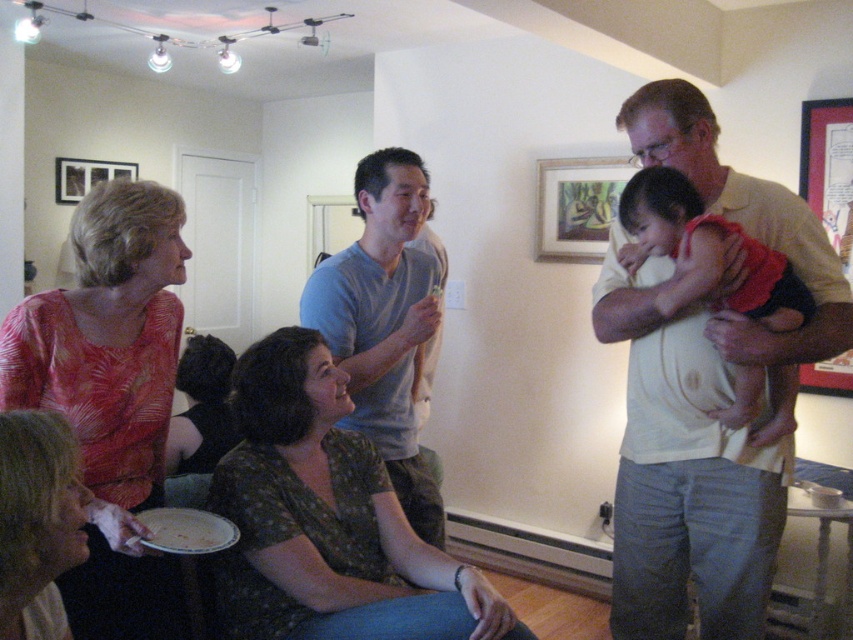
Does point (283, 330) come farther from viewer compared to point (352, 378)?

No, it is not.

Who is more forward, (467, 636) or (433, 492)?

Point (467, 636)

Does point (251, 451) come closer to viewer compared to point (314, 276)?

Yes, point (251, 451) is in front of point (314, 276).

Where is `green floral shirt at center`? Image resolution: width=853 pixels, height=640 pixels. green floral shirt at center is located at coordinates (328, 518).

Based on the photo, is light beige shirt at upper right taller than light blue cotton shirt at center?

Correct, light beige shirt at upper right is much taller as light blue cotton shirt at center.

Which is more to the left, light beige shirt at upper right or light blue cotton shirt at center?

Positioned to the left is light blue cotton shirt at center.

Who is more forward, (x=625, y=448) or (x=416, y=310)?

Point (x=625, y=448) is more forward.

What are the coordinates of `light beige shirt at upper right` in the screenshot? It's located at (701, 394).

Is point (699, 584) in front of point (657, 243)?

No.

Is light beige shirt at upper right wider than matte red shirt at upper right?

Correct, the width of light beige shirt at upper right exceeds that of matte red shirt at upper right.

Is point (698, 573) more distant than point (677, 308)?

That is True.

Identify the location of light beige shirt at upper right. (701, 394).